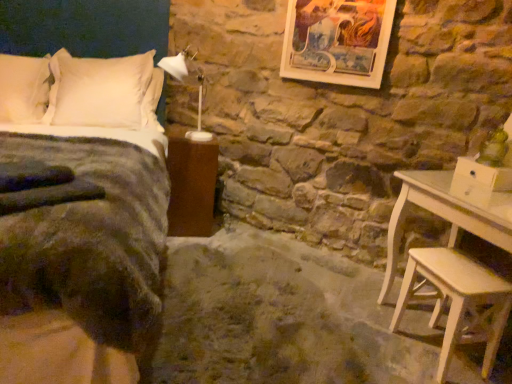
At what (x,y) coordinates should I click in order to perform the action: click on free space above light wood stool at lower right (from a real-world perspective). Please return your answer as a coordinate pair (x, y). The height and width of the screenshot is (384, 512). Looking at the image, I should click on (455, 271).